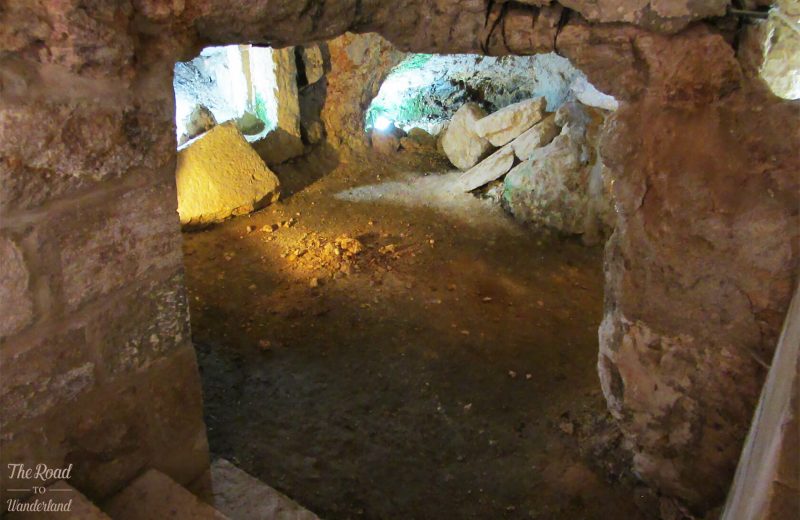
In order to click on entryway in this screenshot , I will do `click(766, 477)`.